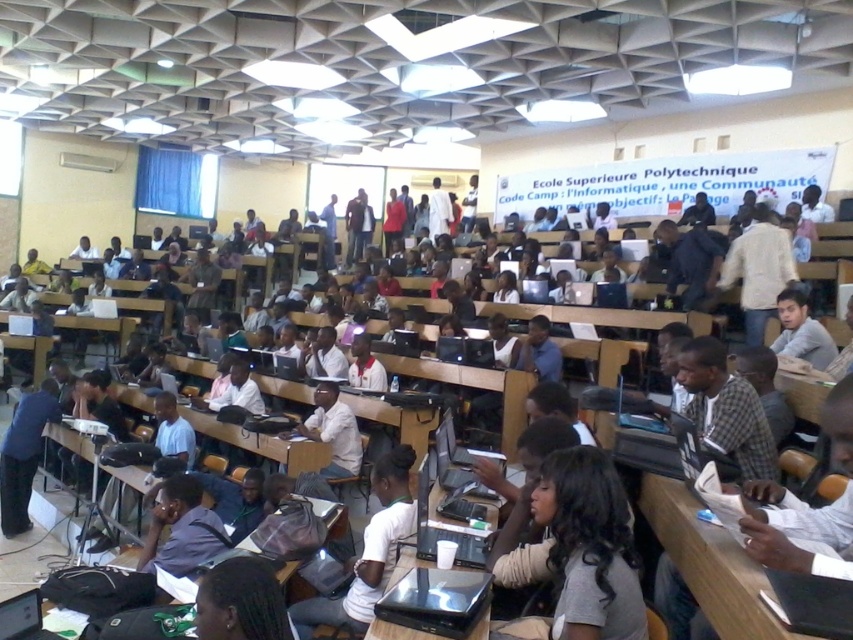
Consider the image. Does white matte backpack at center come in front of dark blue shirt at lower left?

Yes.

Is white matte backpack at center shorter than dark blue shirt at lower left?

No, white matte backpack at center is not shorter than dark blue shirt at lower left.

Identify the location of white matte backpack at center. (367, 552).

Consider the image. Which of these two, dark blue shirt at lower left or wooden table at center, stands taller?

Standing taller between the two is dark blue shirt at lower left.

Does point (183, 548) come closer to viewer compared to point (403, 556)?

No, (183, 548) is further to viewer.

Which is behind, point (148, 548) or point (376, 632)?

Point (148, 548)

Locate an element on the screen. Image resolution: width=853 pixels, height=640 pixels. dark blue shirt at lower left is located at coordinates (181, 529).

Does dark gray hair at center have a lesser width compared to wooden table at center?

In fact, dark gray hair at center might be wider than wooden table at center.

Which is more to the right, dark gray hair at center or wooden table at center?

dark gray hair at center

Does point (625, 580) come farther from viewer compared to point (395, 564)?

That is False.

I want to click on dark gray hair at center, so click(x=589, y=547).